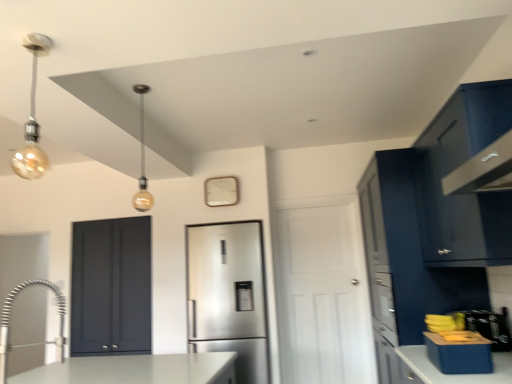
Question: Can you confirm if gold metallic light bulb at upper left, the 1th light fixture positioned from the right, is thinner than matte blue cabinet at right, the second cabinetry when ordered from front to back?

Choices:
 (A) yes
 (B) no

Answer: (A)

Question: From the image's perspective, is gold metallic light bulb at upper left, the 1th light fixture from the back, above matte blue cabinet at right, which is the 1th cabinetry from back to front?

Choices:
 (A) no
 (B) yes

Answer: (B)

Question: Can you confirm if gold metallic light bulb at upper left, the 1th light fixture positioned from the right, is taller than matte blue cabinet at right, the second cabinetry when ordered from front to back?

Choices:
 (A) no
 (B) yes

Answer: (A)

Question: Is gold metallic light bulb at upper left, the 1th light fixture positioned from the right, not within matte blue cabinet at right, which is the 1th cabinetry from back to front?

Choices:
 (A) yes
 (B) no

Answer: (A)

Question: Does gold metallic light bulb at upper left, acting as the 2th light fixture starting from the left, lie behind matte blue cabinet at right, which is the 1th cabinetry from back to front?

Choices:
 (A) yes
 (B) no

Answer: (A)

Question: Could you tell me if gold metallic light bulb at upper left, acting as the 2th light fixture starting from the left, is facing matte blue cabinet at right, the second cabinetry when ordered from front to back?

Choices:
 (A) yes
 (B) no

Answer: (B)

Question: From a real-world perspective, is satin stainless steel refrigerator at center located higher than glossy dark blue cabinet at upper right, which ranks as the first cabinetry in front-to-back order?

Choices:
 (A) no
 (B) yes

Answer: (A)

Question: Is satin stainless steel refrigerator at center wider than glossy dark blue cabinet at upper right, which appears as the 2th cabinetry when viewed from the back?

Choices:
 (A) yes
 (B) no

Answer: (B)

Question: Is satin stainless steel refrigerator at center thinner than glossy dark blue cabinet at upper right, which ranks as the first cabinetry in front-to-back order?

Choices:
 (A) no
 (B) yes

Answer: (B)

Question: Is satin stainless steel refrigerator at center positioned in front of glossy dark blue cabinet at upper right, which ranks as the first cabinetry in front-to-back order?

Choices:
 (A) no
 (B) yes

Answer: (A)

Question: Is satin stainless steel refrigerator at center next to glossy dark blue cabinet at upper right, which appears as the 2th cabinetry when viewed from the back, and touching it?

Choices:
 (A) yes
 (B) no

Answer: (B)

Question: From the image's perspective, does satin stainless steel refrigerator at center appear higher than glossy dark blue cabinet at upper right, which ranks as the first cabinetry in front-to-back order?

Choices:
 (A) yes
 (B) no

Answer: (B)

Question: Could you tell me if satin nickel faucet at lower left is turned towards matte dark blue cabinet at left, which appears as the 1th door when viewed from the left?

Choices:
 (A) yes
 (B) no

Answer: (B)